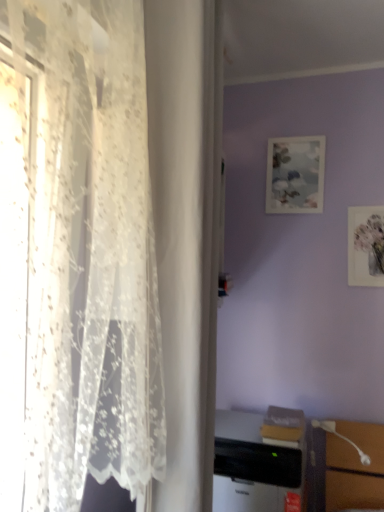
Question: Does matte paper picture frame at upper right, the 1th picture frame viewed from the front, lie in front of matte paper picture frame at upper center, which is counted as the first picture frame, starting from the left?

Choices:
 (A) yes
 (B) no

Answer: (A)

Question: Could you tell me if matte paper picture frame at upper right, which ranks as the 2th picture frame in back-to-front order, is turned towards matte paper picture frame at upper center, the 2th picture frame from the right?

Choices:
 (A) yes
 (B) no

Answer: (B)

Question: From the image's perspective, does matte paper picture frame at upper right, which ranks as the 2th picture frame in back-to-front order, appear higher than matte paper picture frame at upper center, the second picture frame when ordered from bottom to top?

Choices:
 (A) no
 (B) yes

Answer: (A)

Question: Is matte paper picture frame at upper right, which ranks as the 2th picture frame in back-to-front order, facing away from matte paper picture frame at upper center, the first picture frame when ordered from back to front?

Choices:
 (A) yes
 (B) no

Answer: (B)

Question: Is matte paper picture frame at upper right, which is counted as the 2th picture frame, starting from the left, far from matte paper picture frame at upper center, the second picture frame when ordered from bottom to top?

Choices:
 (A) no
 (B) yes

Answer: (A)

Question: In the image, is black plastic desktop computer at lower center on the left side or the right side of matte paper picture frame at upper center, the second picture frame when ordered from bottom to top?

Choices:
 (A) right
 (B) left

Answer: (B)

Question: From their relative heights in the image, would you say black plastic desktop computer at lower center is taller or shorter than matte paper picture frame at upper center, which is counted as the first picture frame, starting from the left?

Choices:
 (A) tall
 (B) short

Answer: (B)

Question: From a real-world perspective, is black plastic desktop computer at lower center above or below matte paper picture frame at upper center, the 2th picture frame from the right?

Choices:
 (A) above
 (B) below

Answer: (B)

Question: From the image's perspective, is black plastic desktop computer at lower center above or below matte paper picture frame at upper center, the first picture frame when ordered from back to front?

Choices:
 (A) above
 (B) below

Answer: (B)

Question: Considering the positions of point (359, 449) and point (382, 210), is point (359, 449) closer or farther from the camera than point (382, 210)?

Choices:
 (A) farther
 (B) closer

Answer: (B)

Question: In terms of width, does white glossy table lamp at lower right look wider or thinner when compared to matte paper picture frame at upper right, the 2th picture frame positioned from the top?

Choices:
 (A) wide
 (B) thin

Answer: (A)

Question: Based on their sizes in the image, would you say white glossy table lamp at lower right is bigger or smaller than matte paper picture frame at upper right, which ranks as the 2th picture frame in back-to-front order?

Choices:
 (A) big
 (B) small

Answer: (A)

Question: In terms of height, does white glossy table lamp at lower right look taller or shorter compared to matte paper picture frame at upper right, marked as the 1th picture frame in a bottom-to-top arrangement?

Choices:
 (A) tall
 (B) short

Answer: (B)

Question: From a real-world perspective, is matte paper picture frame at upper right, the 2th picture frame positioned from the top, positioned above or below white glossy table lamp at lower right?

Choices:
 (A) below
 (B) above

Answer: (B)

Question: Relative to white glossy table lamp at lower right, is matte paper picture frame at upper right, arranged as the first picture frame when viewed from the right, in front or behind?

Choices:
 (A) front
 (B) behind

Answer: (B)